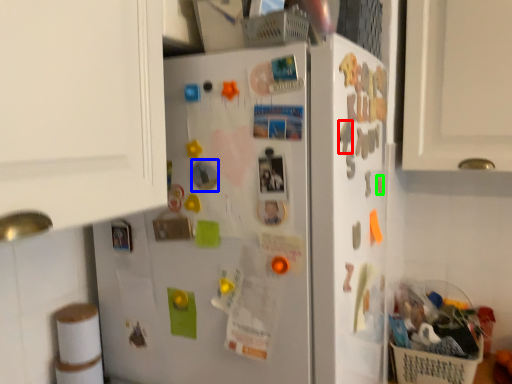
Question: Based on their relative distances, which object is farther from magnet (highlighted by a red box)? Choose from magnet (highlighted by a blue box) and magnet (highlighted by a green box).

Choices:
 (A) magnet
 (B) magnet

Answer: (B)